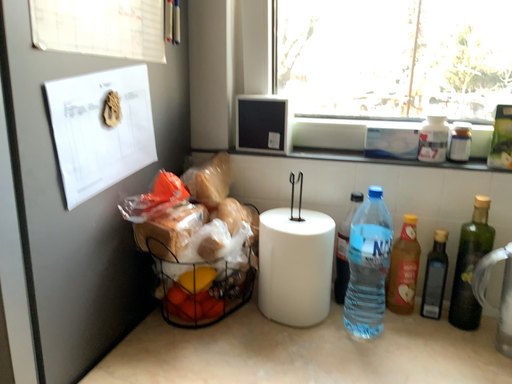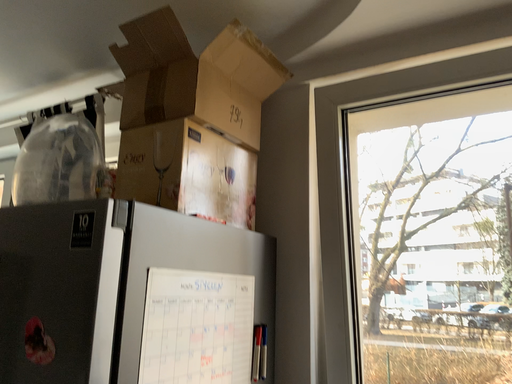
Question: Which way did the camera rotate in the video?

Choices:
 (A) rotated upward
 (B) rotated downward

Answer: (A)